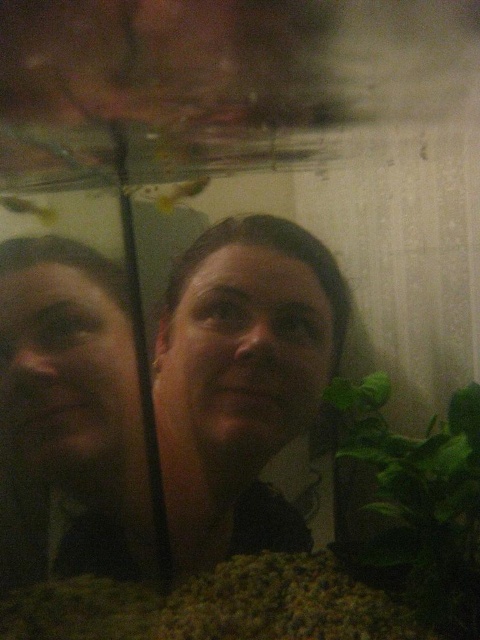
Question: Can you confirm if matte black hair at center is positioned above green leafy plant at lower right?

Choices:
 (A) yes
 (B) no

Answer: (A)

Question: Which of the following is the farthest from the observer?

Choices:
 (A) (252, 300)
 (B) (339, 445)

Answer: (B)

Question: Does matte black hair at center have a larger size compared to green leafy plant at lower right?

Choices:
 (A) no
 (B) yes

Answer: (B)

Question: Which object appears closest to the camera in this image?

Choices:
 (A) matte black hair at center
 (B) green leafy plant at lower right

Answer: (B)

Question: Can you confirm if matte black hair at center is smaller than green leafy plant at lower right?

Choices:
 (A) no
 (B) yes

Answer: (A)